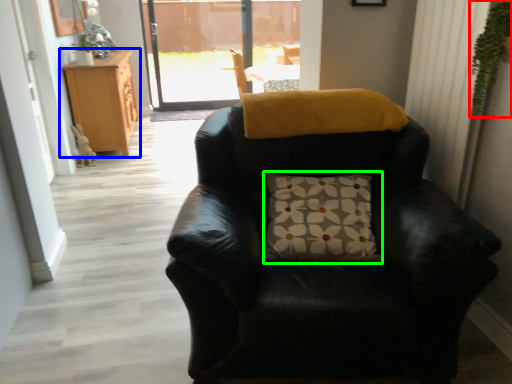
Question: Considering the real-world distances, which object is farthest from plant (highlighted by a red box)? cabinetry (highlighted by a blue box) or pillow (highlighted by a green box)?

Choices:
 (A) cabinetry
 (B) pillow

Answer: (A)